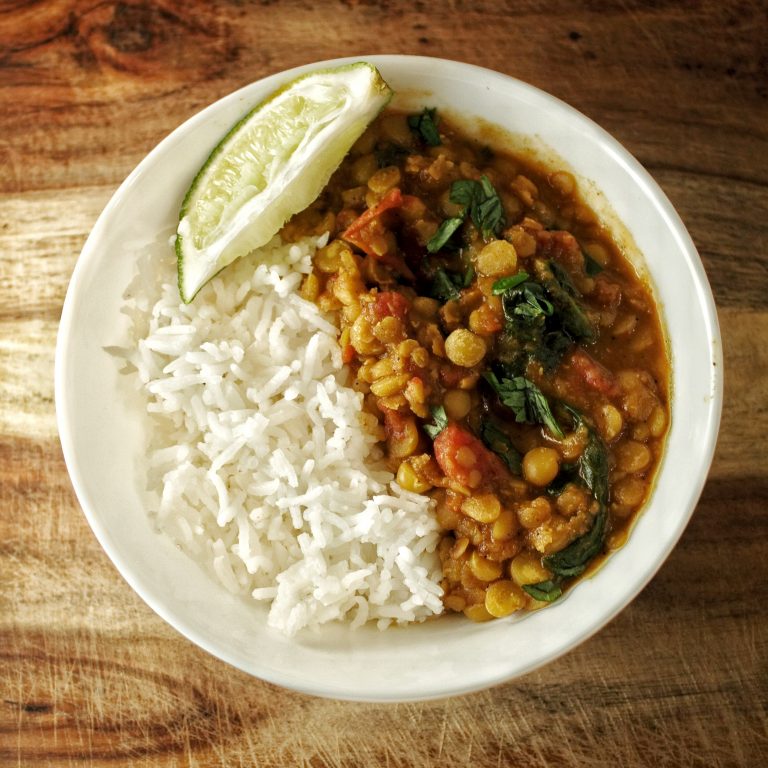
This screenshot has height=768, width=768. I want to click on bowl, so click(468, 641).